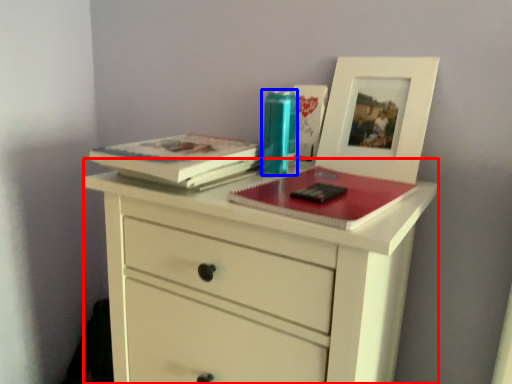
Question: Which point is further to the camera, chest of drawers (highlighted by a red box) or turquoise (highlighted by a blue box)?

Choices:
 (A) chest of drawers
 (B) turquoise

Answer: (B)